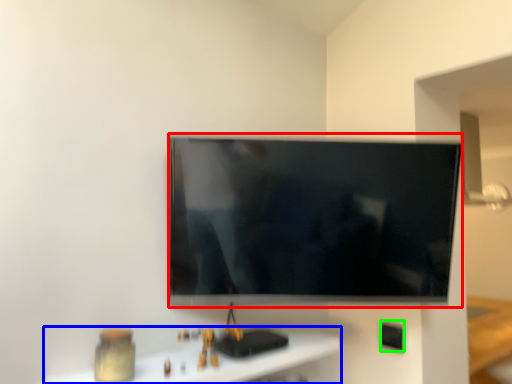
Question: Which is farther away from television (highlighted by a red box)? furniture (highlighted by a blue box) or electric outlet (highlighted by a green box)?

Choices:
 (A) furniture
 (B) electric outlet

Answer: (B)